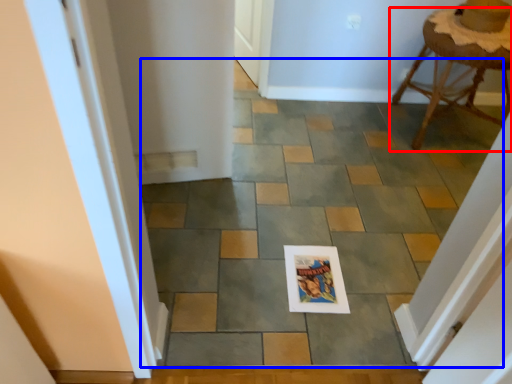
Question: Which point is closer to the camera, stool (highlighted by a red box) or path (highlighted by a blue box)?

Choices:
 (A) stool
 (B) path

Answer: (B)